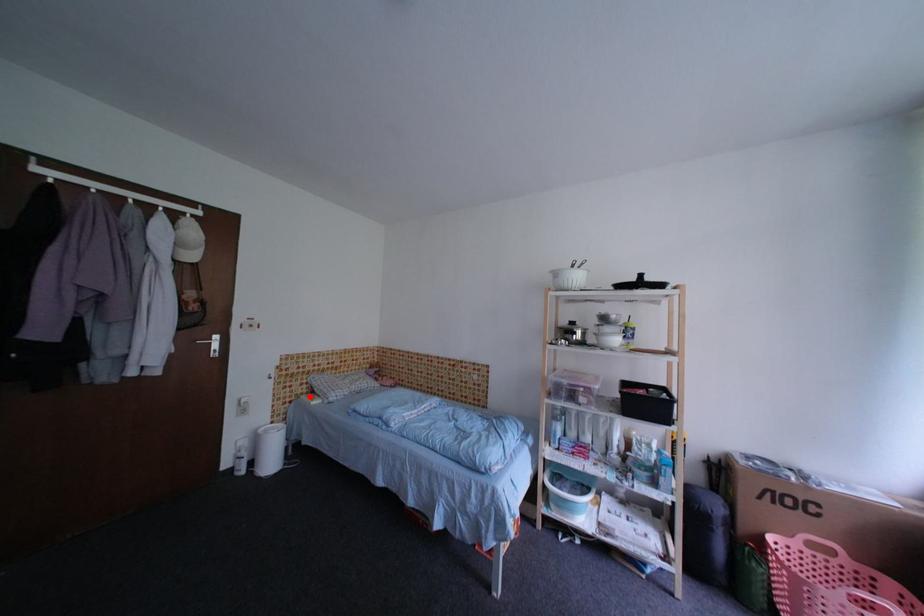
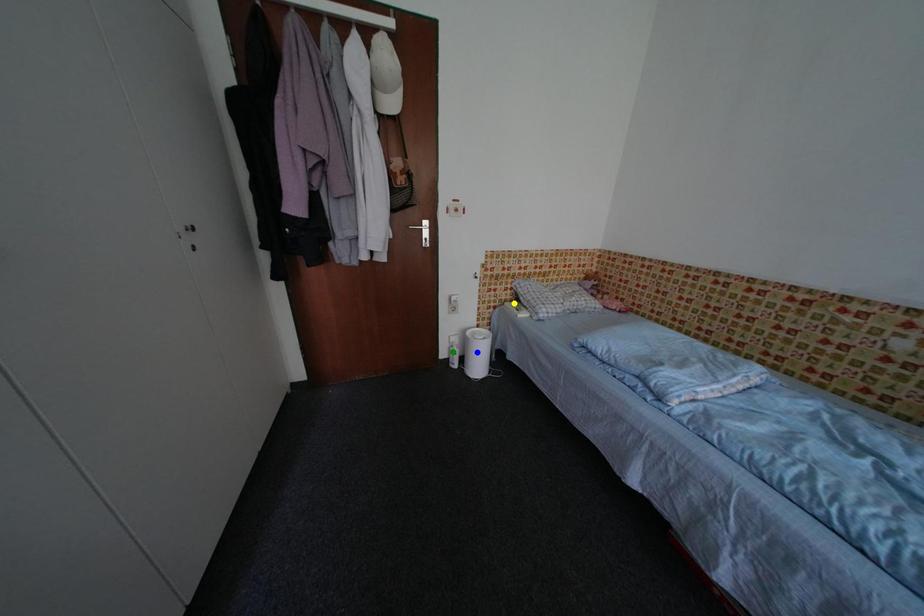
Question: I am providing you with two images of the same scene from different viewpoints. A red point is marked on the first image. You are given multiple points on the second image. Which point in image 2 represents the same 3d spot as the red point in image 1?

Choices:
 (A) yellow point
 (B) green point
 (C) blue point

Answer: (A)